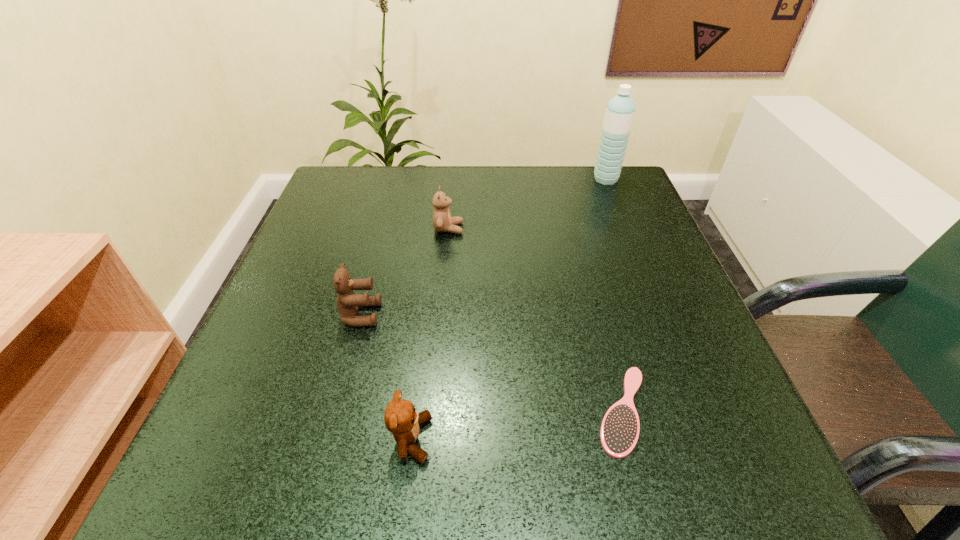
Find the location of a particular element. object positioned at the far right corner is located at coordinates pos(620,110).

Image resolution: width=960 pixels, height=540 pixels. I want to click on object that is at the near right corner, so click(619, 432).

This screenshot has width=960, height=540. In the image, there is a desktop. What are the coordinates of `vacant space at the far edge` in the screenshot? It's located at (548, 217).

In the image, there is a desktop. At what (x,y) coordinates should I click in order to perform the action: click on blank space at the near edge. Please return your answer as a coordinate pair (x, y). Looking at the image, I should click on (361, 481).

Locate an element on the screen. This screenshot has width=960, height=540. vacant space at the left edge of the desktop is located at coordinates (327, 289).

This screenshot has height=540, width=960. In order to click on free space at the right edge of the desktop in this screenshot , I will do `click(647, 262)`.

The width and height of the screenshot is (960, 540). What are the coordinates of `vacant region at the far left corner of the desktop` in the screenshot? It's located at (372, 167).

Identify the location of free space at the far right corner. The image size is (960, 540). (629, 195).

The height and width of the screenshot is (540, 960). I want to click on vacant space in between the farthest teddy bear and the nearest teddy bear, so click(x=430, y=334).

This screenshot has width=960, height=540. Find the location of `vacant area that lies between the rightmost object and the second object from right to left`. vacant area that lies between the rightmost object and the second object from right to left is located at coordinates (614, 295).